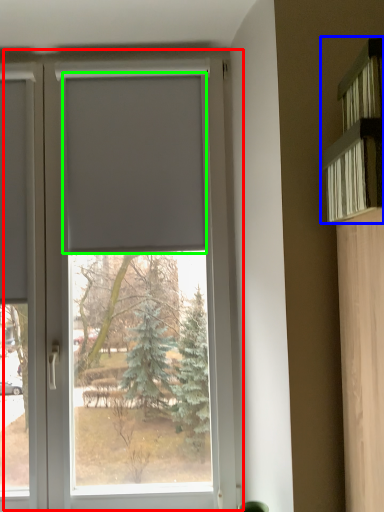
Question: Based on their relative distances, which object is farther from window (highlighted by a red box)? Choose from shelf (highlighted by a blue box) and blind (highlighted by a green box).

Choices:
 (A) shelf
 (B) blind

Answer: (A)